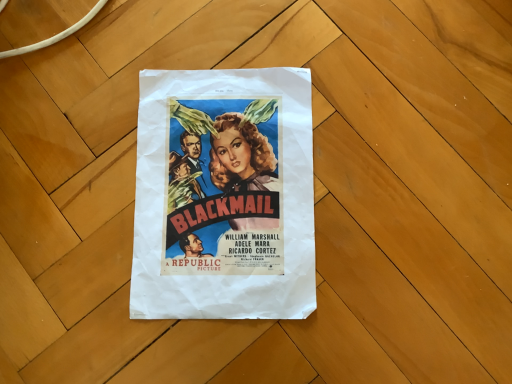
In order to click on blank space situated above matte paper poster at center (from a real-world perspective) in this screenshot , I will do `click(224, 186)`.